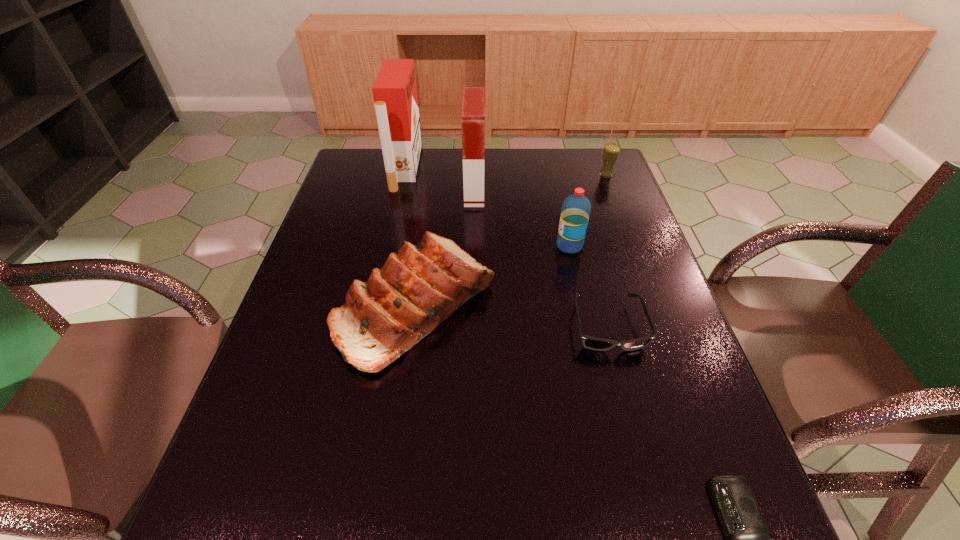
Find the location of `the left cigarette_case`. the left cigarette_case is located at coordinates (394, 91).

Where is `the right cigarette_case`? The height and width of the screenshot is (540, 960). the right cigarette_case is located at coordinates (473, 103).

Locate an element on the screen. The image size is (960, 540). water bottle is located at coordinates (576, 208).

You are a GUI agent. You are given a task and a screenshot of the screen. Output one action in this format:
    pyautogui.click(x=<x>, y=<y>)
    Task: Click on the straw for drinking
    The height and width of the screenshot is (540, 960).
    Given the screenshot: What is the action you would take?
    pyautogui.click(x=611, y=151)

Locate an element on the screen. bread is located at coordinates (419, 287).

This screenshot has height=540, width=960. Find the location of `sunglasses`. sunglasses is located at coordinates (594, 343).

Find the location of `vacant area situated on the front-facing side of the left cigarette_case`. vacant area situated on the front-facing side of the left cigarette_case is located at coordinates (538, 168).

Where is `vacant space located 0.270m on the front-facing side of the right cigarette_case`? The height and width of the screenshot is (540, 960). vacant space located 0.270m on the front-facing side of the right cigarette_case is located at coordinates (569, 190).

Locate an element on the screen. This screenshot has width=960, height=540. vacant region located 0.340m on the front label of the water bottle is located at coordinates (432, 246).

This screenshot has width=960, height=540. Find the location of `vacant space positioned on the front label of the water bottle`. vacant space positioned on the front label of the water bottle is located at coordinates (535, 246).